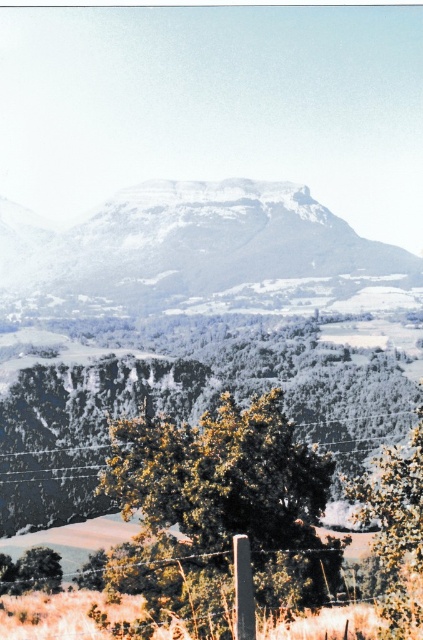
You are standing at the lower right corner of the image. Looking towards the center, which tree comes first in your line of sight? The green leafy tree at center or the green matte tree at lower right?

The green leafy tree at center comes first in your line of sight because it is positioned to the left of the green matte tree at lower right, meaning it is closer to the center and thus would be seen before the tree at the lower right when looking towards the center.